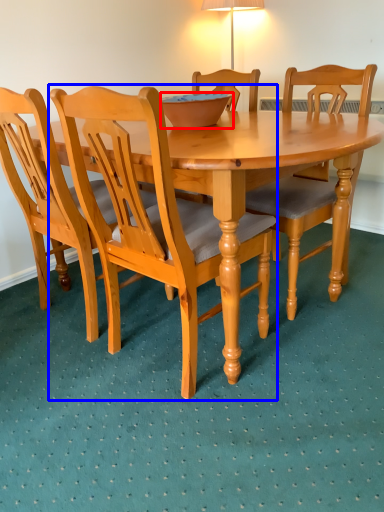
Question: Which of the following is the farthest to the observer, bowl (highlighted by a red box) or chair (highlighted by a blue box)?

Choices:
 (A) bowl
 (B) chair

Answer: (A)